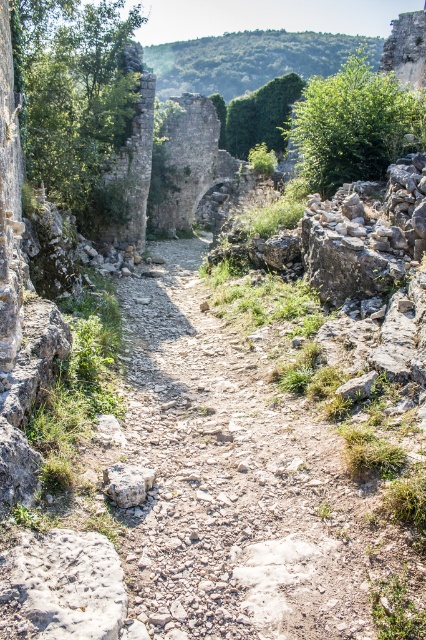
You are a hiker carrying a heavy backpack and you need to step on the gray rough stone at lower left and the gray rough stone at center to cross the narrow path. Which stone should you step on first to avoid slipping?

You should step on the gray rough stone at lower left first because it is positioned under the gray rough stone at center, making it more stable and less likely to cause slipping.